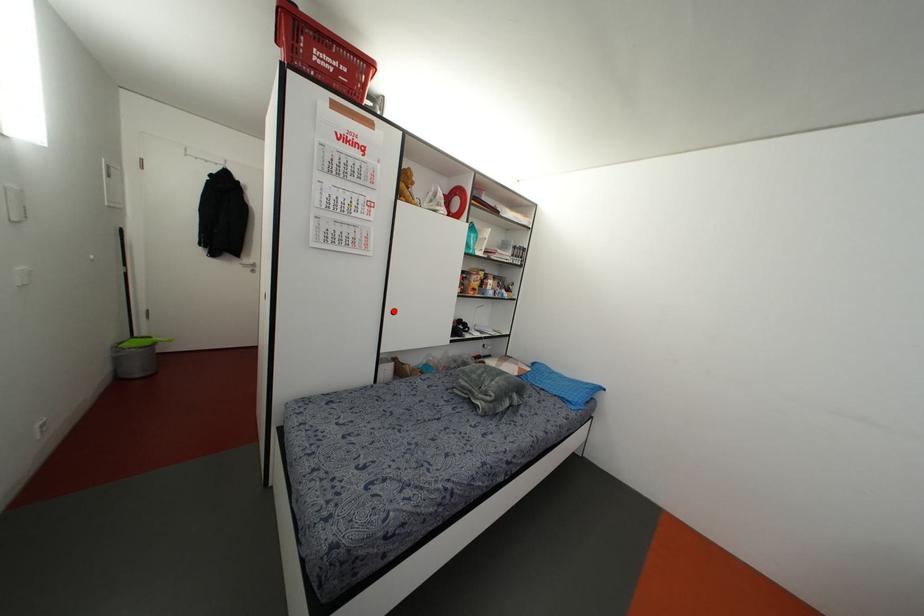
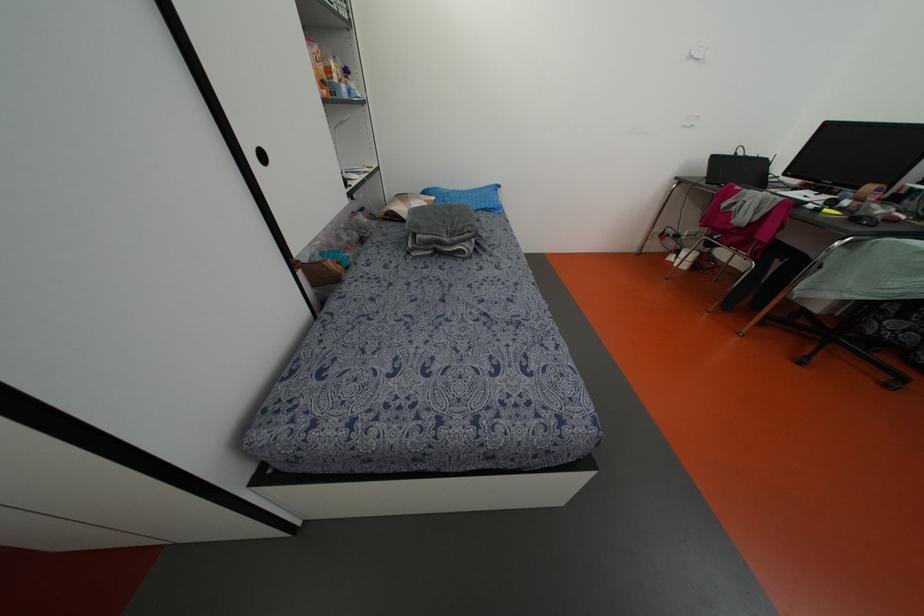
Where in the second image is the point corresponding to the highlighted location from the first image?

(262, 156)